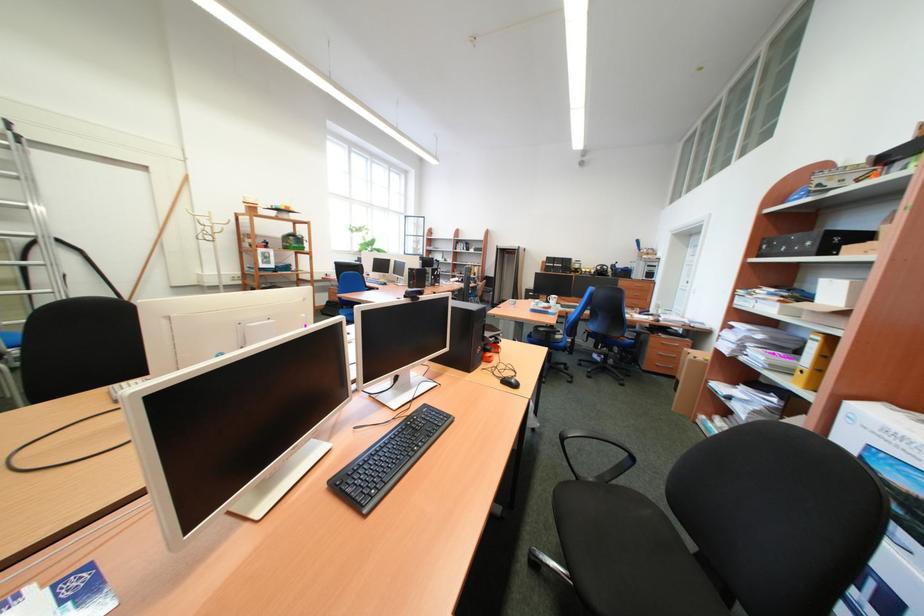
Find where to grasp the white mug handle. Please return your answer as a coordinate pair (x, y).

(253, 331)